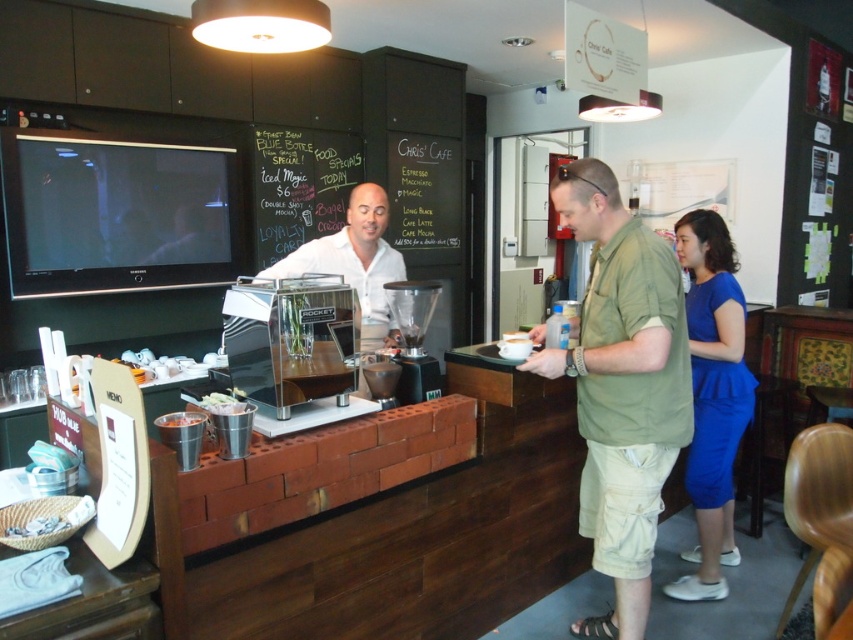
Consider the image. You are a customer at the cozy cafe and want to know which clothing item is bigger between the green cotton shirt at right and the blue satin dress at lower right. Can you tell me?

The green cotton shirt at right is larger in size than the blue satin dress at lower right.

You are a customer in the cafe and you want to order a drink. You notice the green cotton shirt at right and the black chalkboard at upper center. Which object is larger in size?

The green cotton shirt at right is bigger than the black chalkboard at upper center.